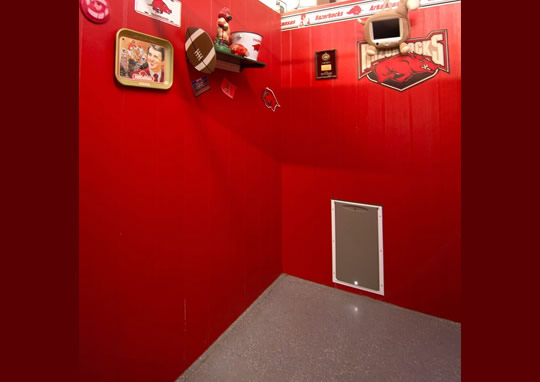
What are the coordinates of `monitor` in the screenshot? It's located at (387, 28).